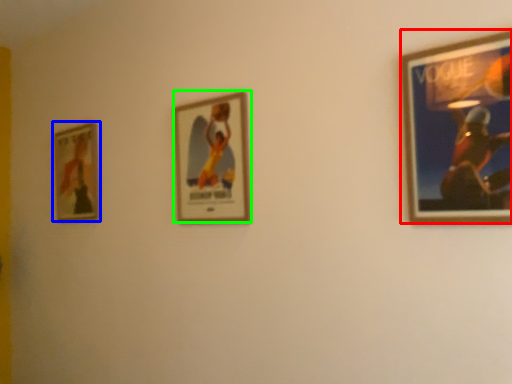
Question: Which object is positioned closest to picture frame (highlighted by a red box)? Select from picture frame (highlighted by a blue box) and picture frame (highlighted by a green box).

Choices:
 (A) picture frame
 (B) picture frame

Answer: (B)